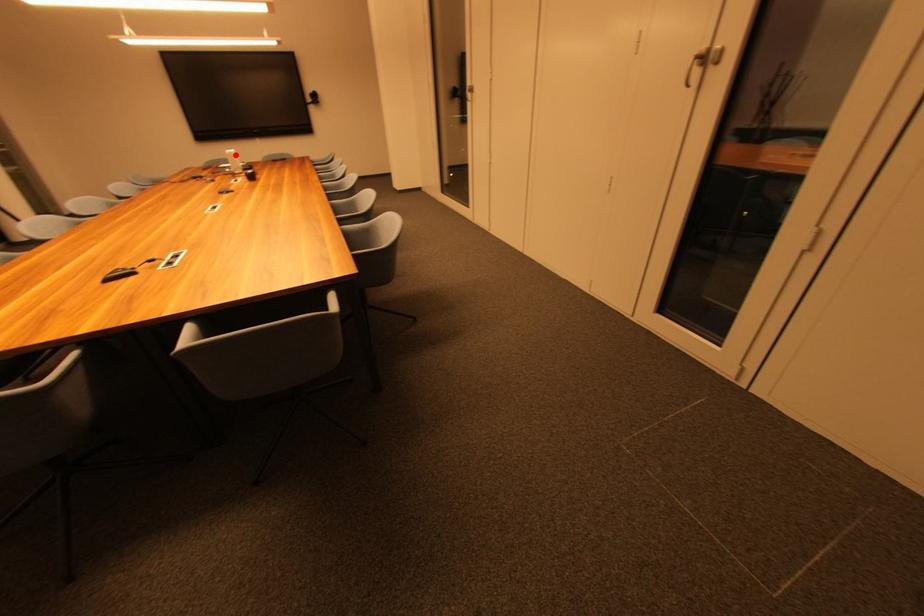
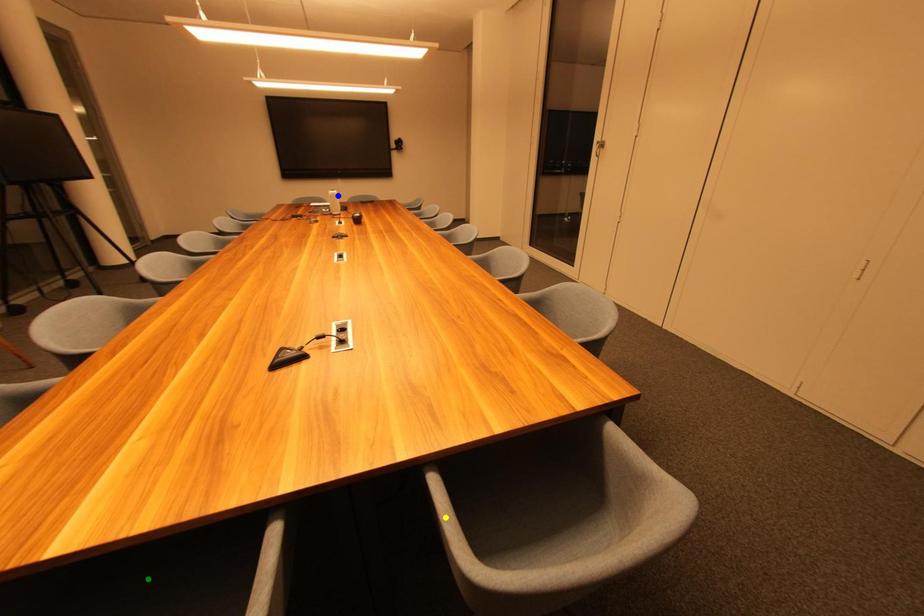
Question: I am providing you with two images of the same scene from different viewpoints. A red point is marked on the first image. You are given multiple points on the second image. Which mark in image 2 goes with the point in image 1?

Choices:
 (A) blue point
 (B) green point
 (C) yellow point

Answer: (A)